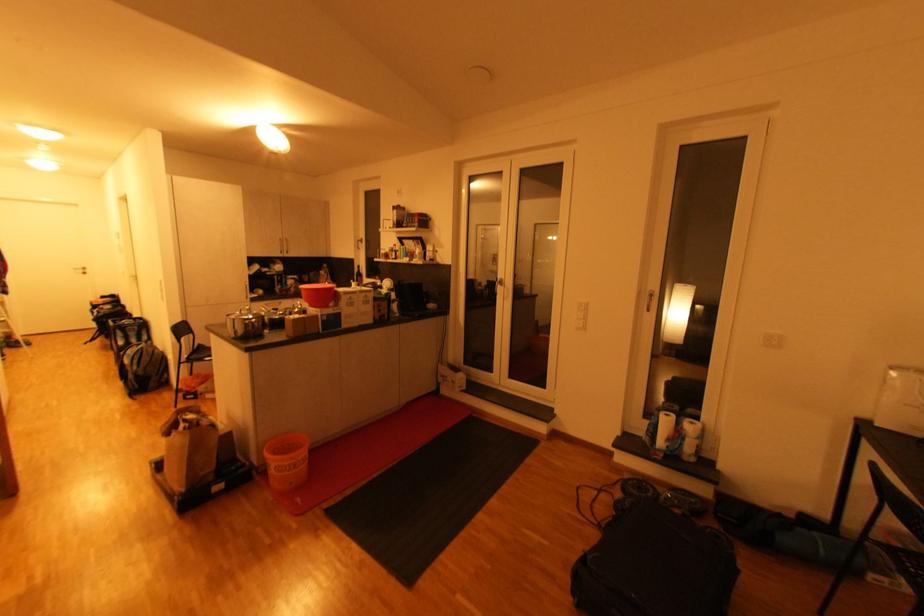
This screenshot has width=924, height=616. Describe the element at coordinates (245, 323) in the screenshot. I see `the pot lid handle` at that location.